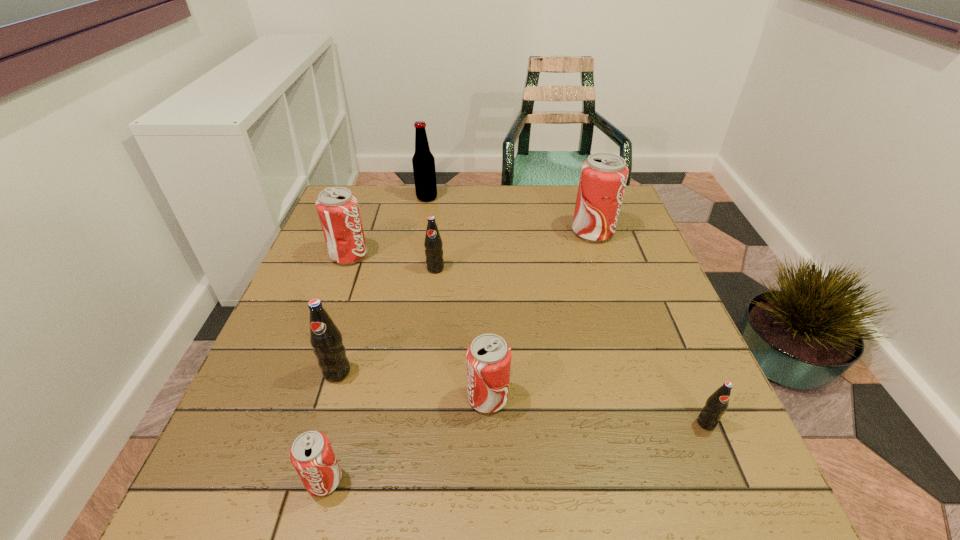
This screenshot has height=540, width=960. Find the location of `beer bottle`. beer bottle is located at coordinates (423, 161).

Identify the location of the sixth soda can from left to right. This screenshot has width=960, height=540. (603, 177).

Locate an element on the screen. The height and width of the screenshot is (540, 960). the tallest soda can is located at coordinates (603, 177).

Where is `the second nearest black pop`? The width and height of the screenshot is (960, 540). the second nearest black pop is located at coordinates (325, 338).

Where is `the biggest black pop`? The width and height of the screenshot is (960, 540). the biggest black pop is located at coordinates (325, 338).

At what (x,y) coordinates should I click in order to perform the action: click on the leftmost pink soda can. Please return your answer as a coordinate pair (x, y). Looking at the image, I should click on (337, 208).

What are the coordinates of `the fourth soda can from left to right` in the screenshot? It's located at (433, 244).

Find the location of a particular element. the farthest black pop is located at coordinates (433, 244).

Where is `the third farthest pink soda can`? The width and height of the screenshot is (960, 540). the third farthest pink soda can is located at coordinates (488, 357).

Find the location of a particular element. This screenshot has width=960, height=540. the third biggest pink soda can is located at coordinates (488, 357).